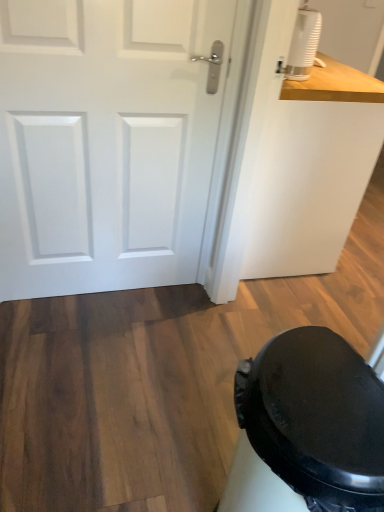
Question: From the image's perspective, is white matte door at upper left located above black matte potty at lower right?

Choices:
 (A) no
 (B) yes

Answer: (B)

Question: Can you confirm if white matte door at upper left is bigger than black matte potty at lower right?

Choices:
 (A) yes
 (B) no

Answer: (B)

Question: Does white matte door at upper left appear on the right side of black matte potty at lower right?

Choices:
 (A) no
 (B) yes

Answer: (A)

Question: From a real-world perspective, is white matte door at upper left on black matte potty at lower right?

Choices:
 (A) no
 (B) yes

Answer: (B)

Question: Can you confirm if white matte door at upper left is wider than black matte potty at lower right?

Choices:
 (A) yes
 (B) no

Answer: (B)

Question: From their relative heights in the image, would you say black matte potty at lower right is taller or shorter than white matte humidifier at upper right?

Choices:
 (A) tall
 (B) short

Answer: (A)

Question: Considering the positions of point (379, 390) and point (304, 24), is point (379, 390) closer or farther from the camera than point (304, 24)?

Choices:
 (A) farther
 (B) closer

Answer: (B)

Question: Looking at the image, does black matte potty at lower right seem bigger or smaller compared to white matte humidifier at upper right?

Choices:
 (A) small
 (B) big

Answer: (B)

Question: Which is correct: black matte potty at lower right is inside white matte humidifier at upper right, or outside of it?

Choices:
 (A) inside
 (B) outside

Answer: (B)

Question: Visually, is black matte potty at lower right positioned to the left or to the right of white matte door at upper left?

Choices:
 (A) left
 (B) right

Answer: (B)

Question: From their relative heights in the image, would you say black matte potty at lower right is taller or shorter than white matte door at upper left?

Choices:
 (A) short
 (B) tall

Answer: (A)

Question: Is black matte potty at lower right inside the boundaries of white matte door at upper left, or outside?

Choices:
 (A) outside
 (B) inside

Answer: (A)

Question: From the image's perspective, relative to white matte door at upper left, is black matte potty at lower right above or below?

Choices:
 (A) above
 (B) below

Answer: (B)

Question: From the image's perspective, is white matte door at upper left located above or below white matte humidifier at upper right?

Choices:
 (A) below
 (B) above

Answer: (A)

Question: In terms of width, does white matte door at upper left look wider or thinner when compared to white matte humidifier at upper right?

Choices:
 (A) wide
 (B) thin

Answer: (B)